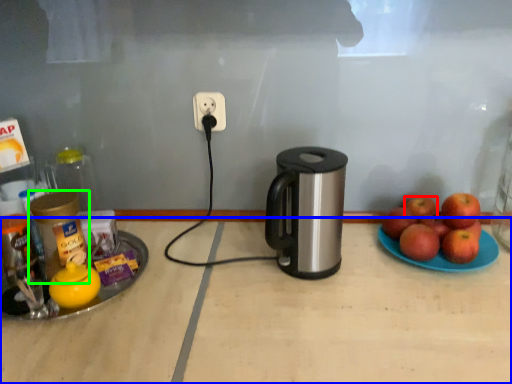
Question: Based on their relative distances, which object is farther from apple (highlighted by a red box)? Choose from table (highlighted by a blue box) and bottle (highlighted by a green box).

Choices:
 (A) table
 (B) bottle

Answer: (B)